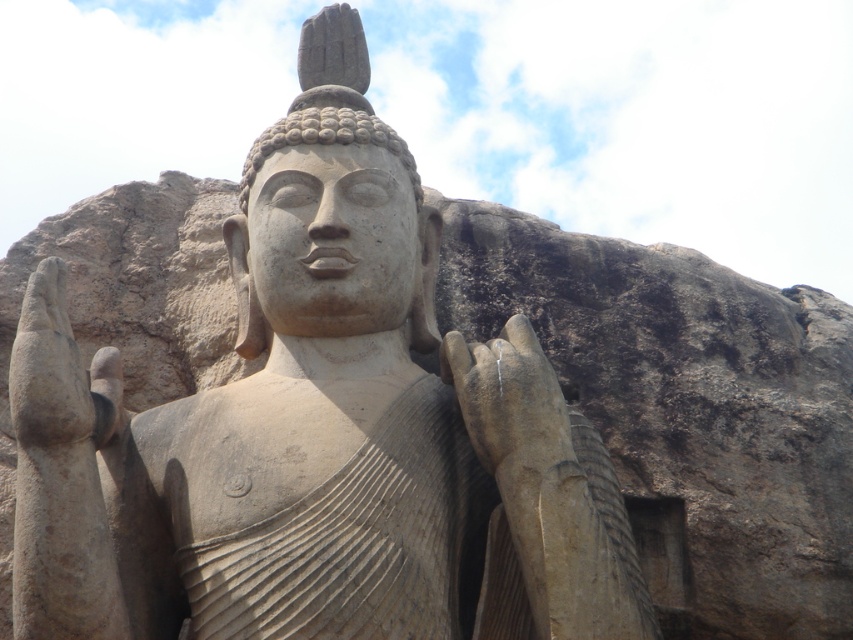
Which is above, smooth stone hand at center or matte stone hand at left?

matte stone hand at left is above.

Who is more forward, (514, 422) or (20, 408)?

Positioned in front is point (20, 408).

Is point (529, 419) closer to camera compared to point (39, 401)?

No, (529, 419) is further to viewer.

Find the location of a particular element. smooth stone hand at center is located at coordinates (509, 403).